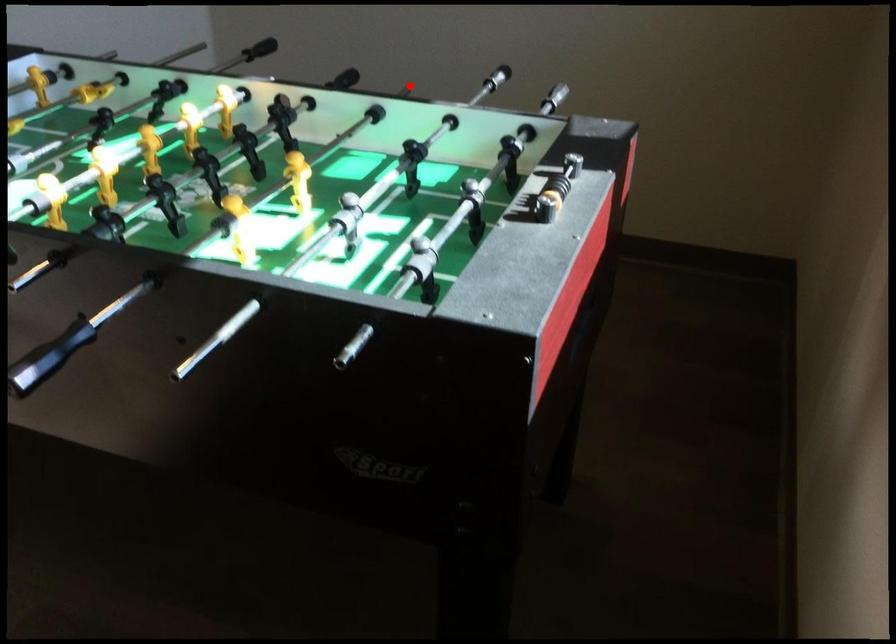
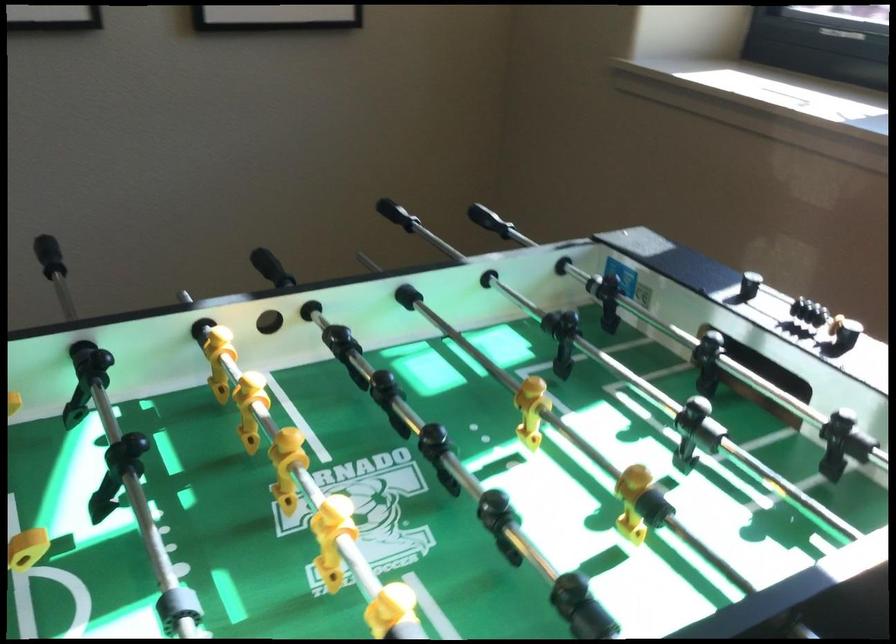
Find the pixel in the second image that matches the highlighted location in the first image.

(48, 256)